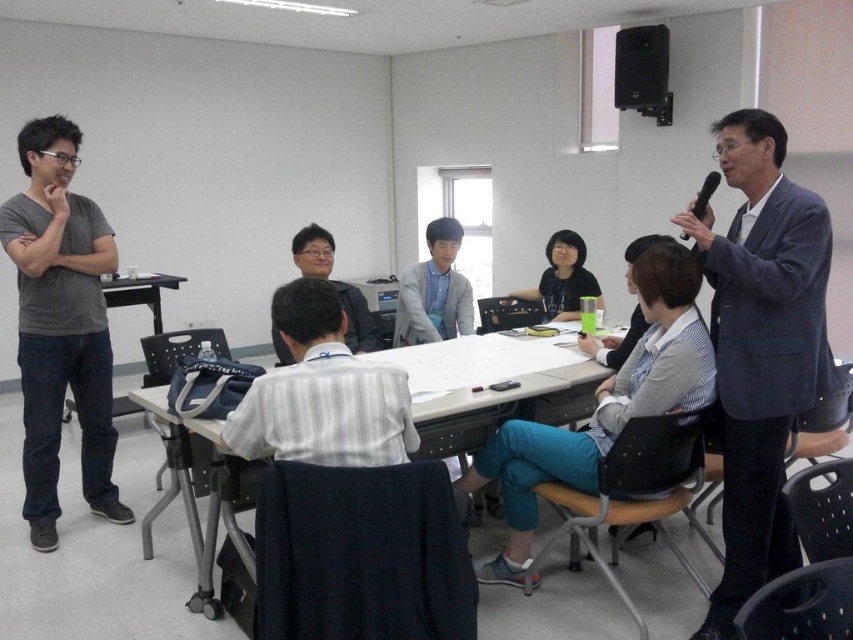
You are organizing a small event and need to place a 12 inch wide decorative plate between the matte gray sweater at center and the black plastic microphone at upper right. Can the space between them accommodate the plate?

The matte gray sweater at center is wider than the black plastic microphone at upper right. However, the exact distance between them isn

You are standing at the entrance of the meeting room and want to locate the person wearing the matte gray sweater at center. According to the coordinates provided, where should you look to find them?

The person wearing the matte gray sweater at center is located at coordinates point (434,291).